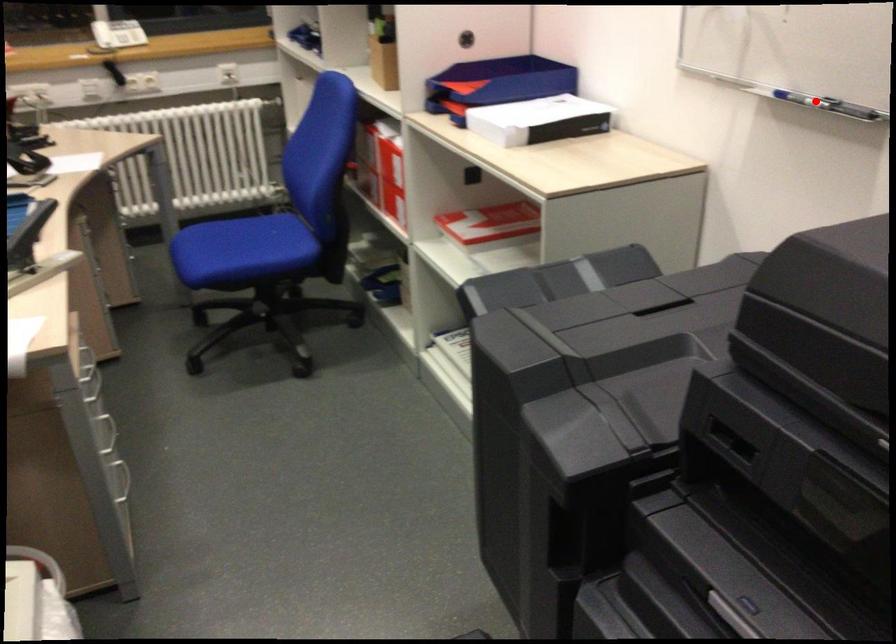
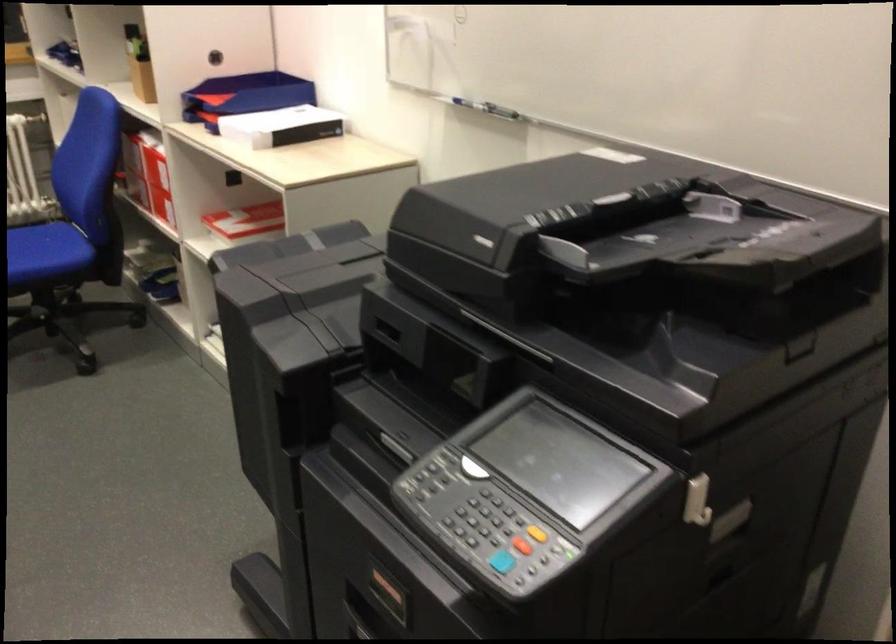
Question: A red point is marked in image1. In image2, is the corresponding 3D point closer to the camera or farther? Reply with the corresponding letter.

Choices:
 (A) The corresponding 3D point is closer.
 (B) The corresponding 3D point is farther.

Answer: (B)